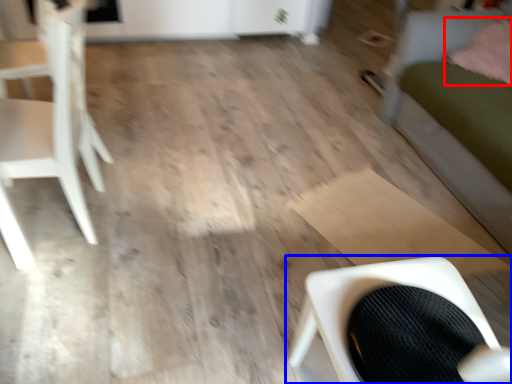
Question: Which object appears farthest to the camera in this image, pillow (highlighted by a red box) or chair (highlighted by a blue box)?

Choices:
 (A) pillow
 (B) chair

Answer: (A)